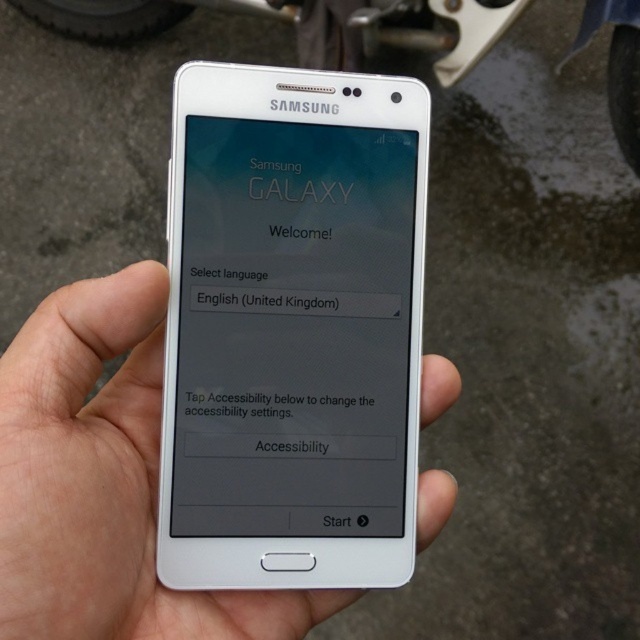
Is white glossy screen at center to the left of metallic silver motorbike at upper center from the viewer's perspective?

Correct, you'll find white glossy screen at center to the left of metallic silver motorbike at upper center.

Does white glossy screen at center have a greater width compared to metallic silver motorbike at upper center?

Incorrect, white glossy screen at center's width does not surpass metallic silver motorbike at upper center's.

Does point (392, 296) come behind point (349, 51)?

No, (392, 296) is closer to viewer.

Identify the location of white glossy screen at center. The image size is (640, 640). (292, 330).

In the scene shown: Can you confirm if white glossy screen at center is wider than white matte phone at center?

No.

In order to click on white glossy screen at center in this screenshot , I will do `click(292, 330)`.

Is point (394, 364) farther from viewer compared to point (342, 608)?

No, (394, 364) is closer to viewer.

Identify the location of white glossy screen at center. (292, 330).

Does white matte phone at center have a lesser width compared to metallic silver motorbike at upper center?

Correct, white matte phone at center's width is less than metallic silver motorbike at upper center's.

Does white matte phone at center have a greater width compared to metallic silver motorbike at upper center?

Incorrect, white matte phone at center's width does not surpass metallic silver motorbike at upper center's.

Is point (74, 474) positioned after point (113, 24)?

No, it is not.

Where is `white matte phone at center`? The width and height of the screenshot is (640, 640). white matte phone at center is located at coordinates (x=104, y=481).